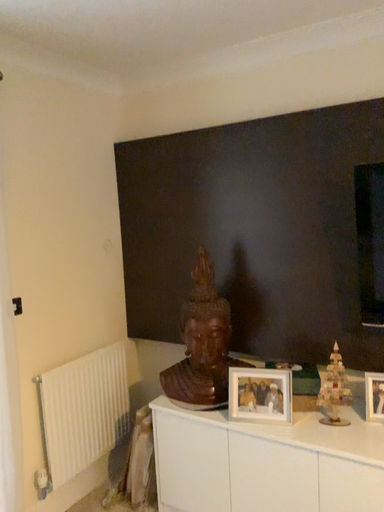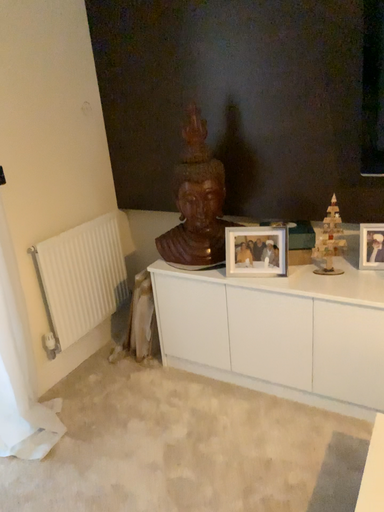
Question: Which way did the camera rotate in the video?

Choices:
 (A) rotated upward
 (B) rotated downward

Answer: (B)